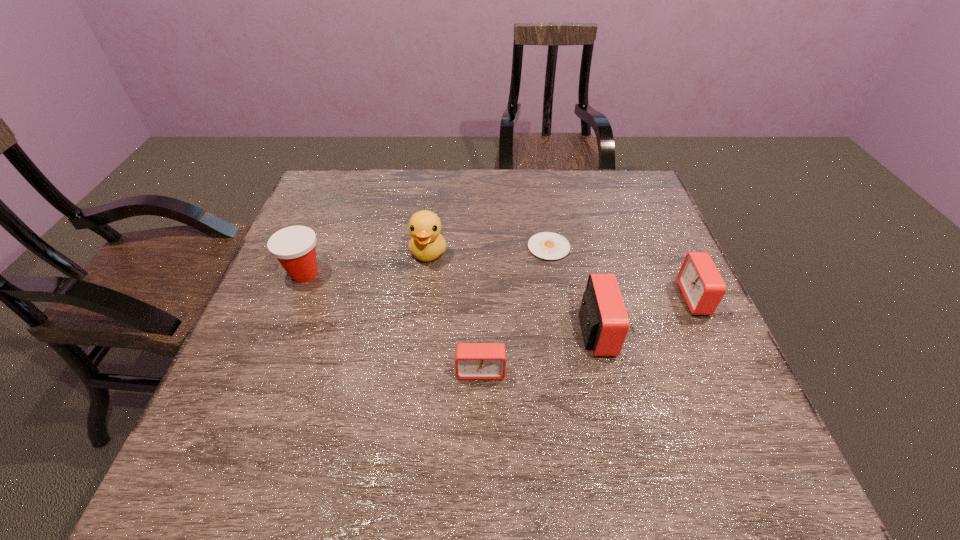
Considering the uniform spacing of alarm clocks, where should an additional alarm clock be positioned on the left? Please locate a free spot. Please provide its 2D coordinates. Your answer should be formatted as a tuple, i.e. [(x, y)], where the tuple contains the x and y coordinates of a point satisfying the conditions above.

[(346, 417)]